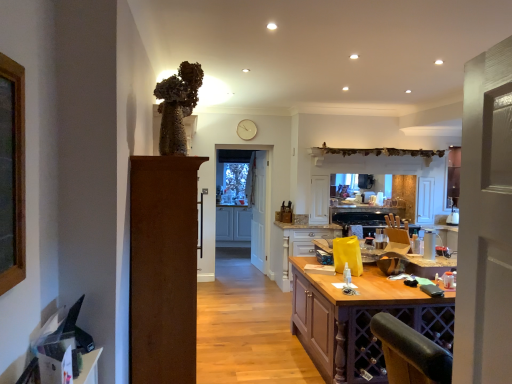
Where is `vacant point to the left of white wooden door at center, marked as the 2th door in a front-to-back arrangement`? vacant point to the left of white wooden door at center, marked as the 2th door in a front-to-back arrangement is located at coordinates (238, 267).